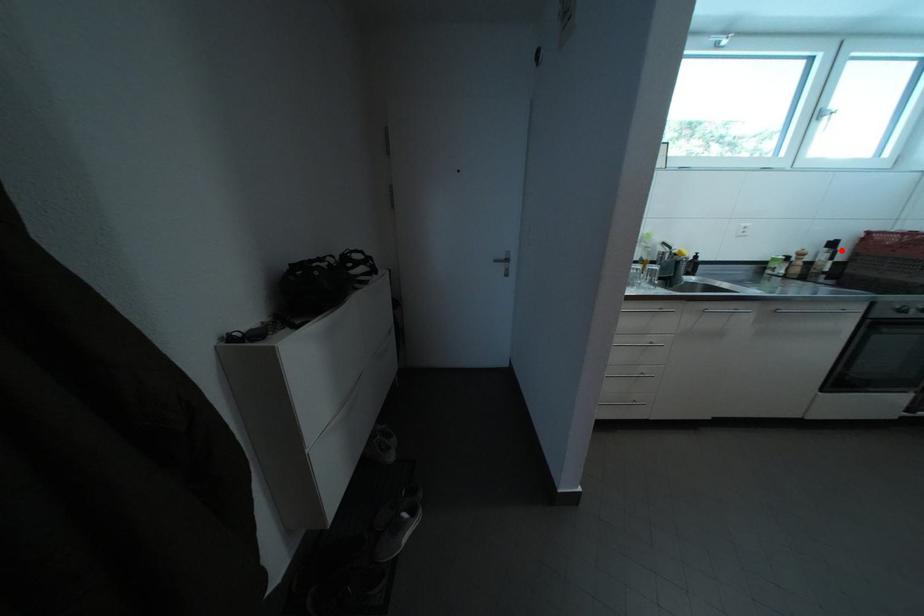
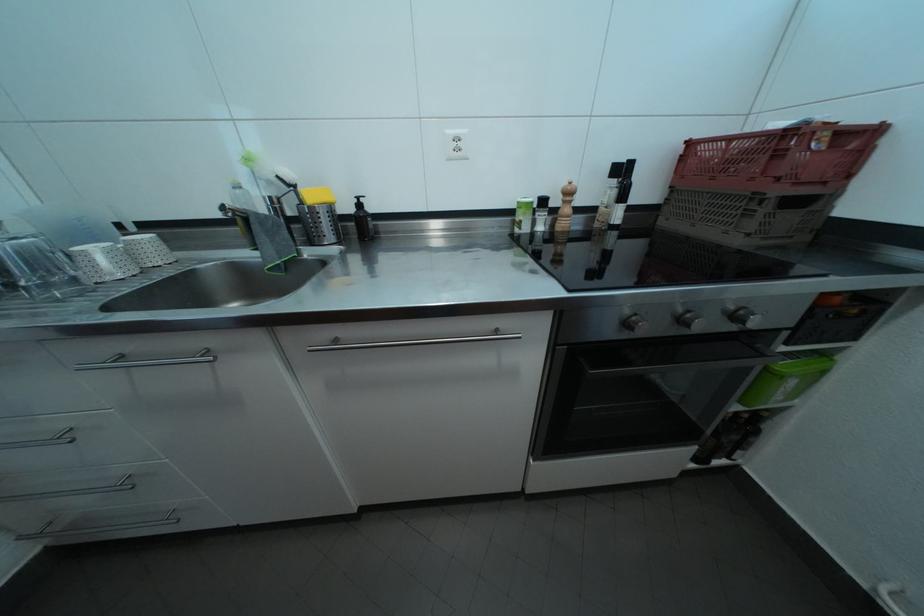
Question: I am providing you with two images of the same scene from different viewpoints. In image1, a red point is highlighted. Considering the same 3D point in image2, which of the following is correct?

Choices:
 (A) It is closer
 (B) It is farther

Answer: (A)